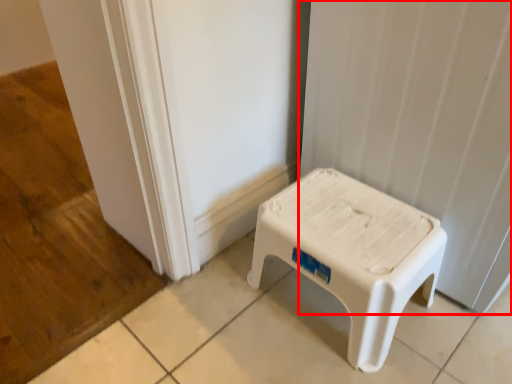
Question: From the image's perspective, what is the correct spatial positioning of curtain (annotated by the red box) in reference to stool?

Choices:
 (A) below
 (B) above

Answer: (B)